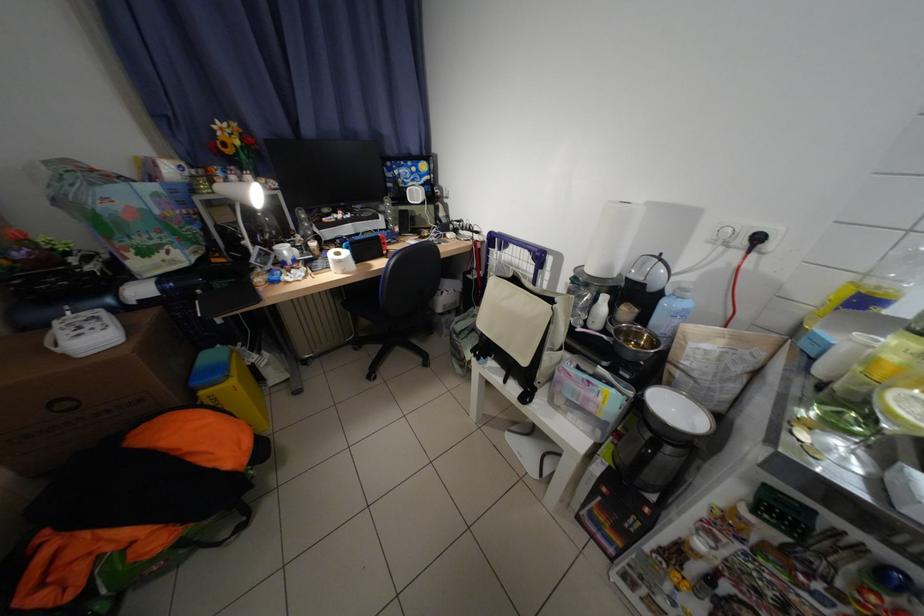
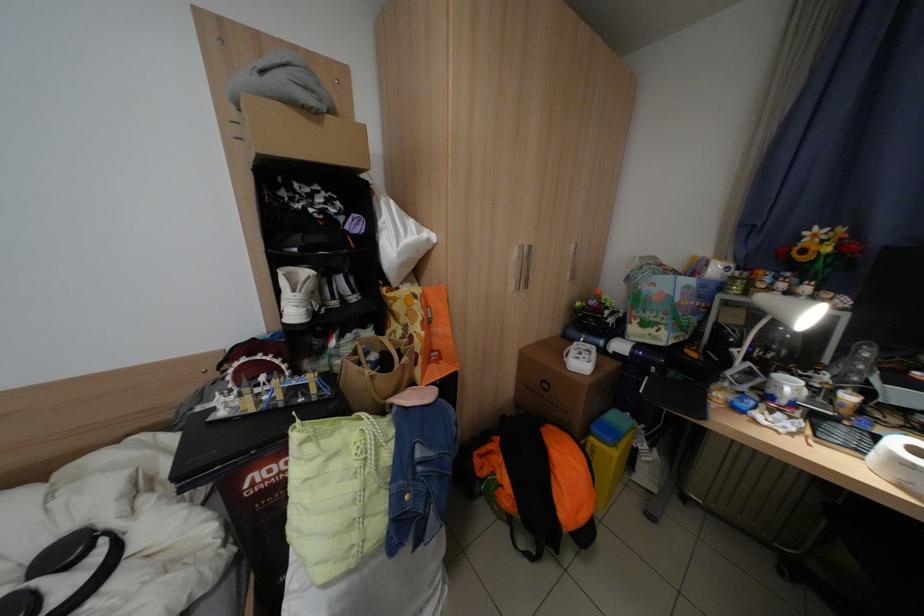
Locate, in the second image, the point that corresponds to [342,254] in the first image.

(906, 442)